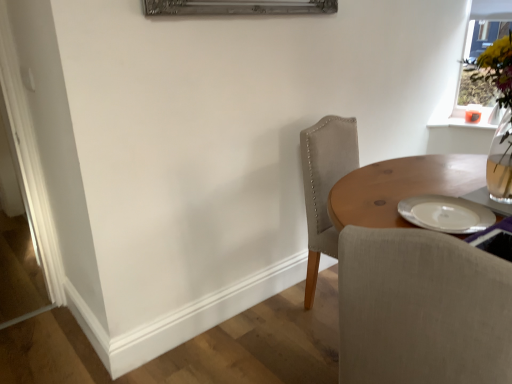
Question: In terms of height, does light gray fabric chair at center look taller or shorter compared to transparent glass vase at upper right?

Choices:
 (A) short
 (B) tall

Answer: (B)

Question: In terms of size, does light gray fabric chair at center appear bigger or smaller than transparent glass vase at upper right?

Choices:
 (A) big
 (B) small

Answer: (A)

Question: Considering the positions of light gray fabric chair at center and transparent glass vase at upper right in the image, is light gray fabric chair at center wider or thinner than transparent glass vase at upper right?

Choices:
 (A) wide
 (B) thin

Answer: (A)

Question: Is transparent glass vase at upper right wider or thinner than light gray fabric chair at center?

Choices:
 (A) wide
 (B) thin

Answer: (B)

Question: Does point (459, 107) appear closer or farther from the camera than point (442, 319)?

Choices:
 (A) farther
 (B) closer

Answer: (A)

Question: Would you say transparent glass vase at upper right is inside or outside light gray fabric chair at center?

Choices:
 (A) outside
 (B) inside

Answer: (A)

Question: Is transparent glass vase at upper right to the left or to the right of light gray fabric chair at center in the image?

Choices:
 (A) right
 (B) left

Answer: (A)